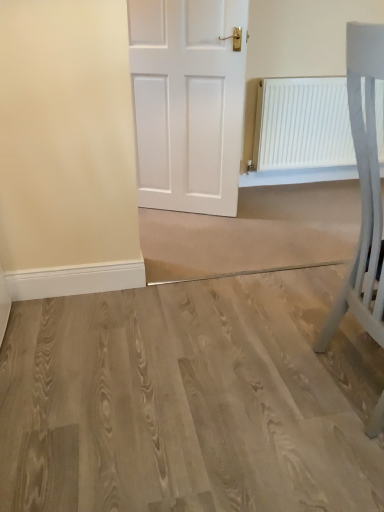
Question: Is white matte radiator at upper right inside or outside of white matte chair at right?

Choices:
 (A) inside
 (B) outside

Answer: (B)

Question: Relative to white matte chair at right, is white matte radiator at upper right in front or behind?

Choices:
 (A) behind
 (B) front

Answer: (A)

Question: Which of these objects is positioned closest to the white matte chair at right?

Choices:
 (A) light wood floor at center
 (B) white matte radiator at upper right

Answer: (A)

Question: Considering the real-world distances, which object is closest to the white matte chair at right?

Choices:
 (A) light wood floor at center
 (B) white matte radiator at upper right

Answer: (A)